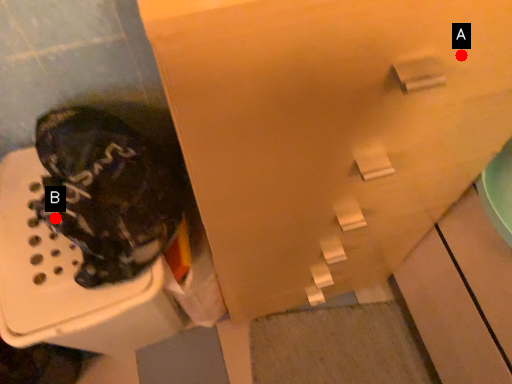
Question: Two points are circled on the image, labeled by A and B beside each circle. Which point appears closest to the camera in this image?

Choices:
 (A) A is closer
 (B) B is closer

Answer: (A)